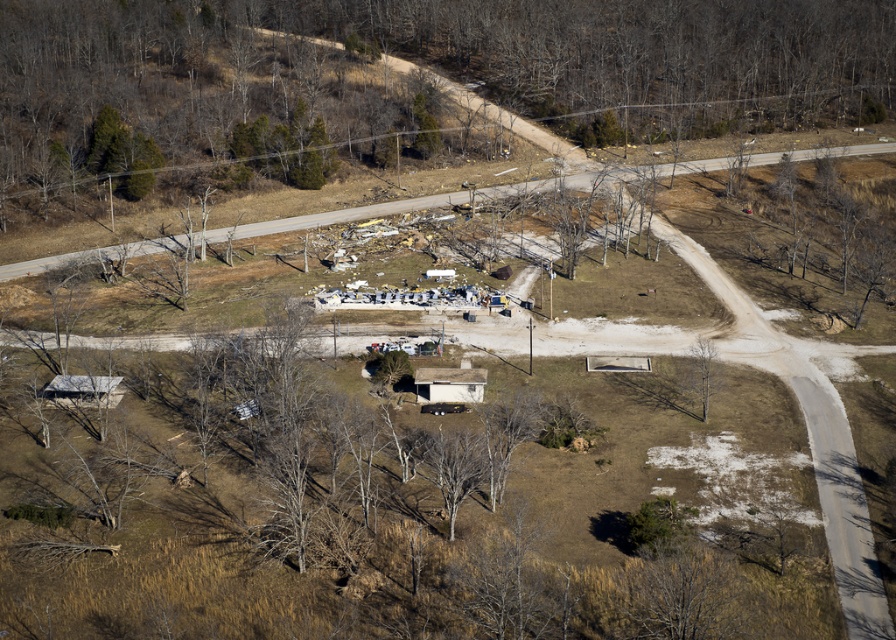
Question: Can you confirm if bare wood tree at center is positioned below green leafy tree at center?

Choices:
 (A) yes
 (B) no

Answer: (A)

Question: In this image, where is bare wood tree at lower right located relative to green leafy tree at center?

Choices:
 (A) below
 (B) above

Answer: (A)

Question: Observing the image, what is the correct spatial positioning of bare wood tree at lower right in reference to green leafy tree at center?

Choices:
 (A) left
 (B) right

Answer: (B)

Question: Among these objects, which one is nearest to the camera?

Choices:
 (A) bare wood tree at lower right
 (B) bare wood tree at center
 (C) green leafy tree at center

Answer: (B)

Question: Which object is farther from the camera taking this photo?

Choices:
 (A) bare wood tree at center
 (B) bare wood tree at lower right

Answer: (B)

Question: Which of the following is the closest to the observer?

Choices:
 (A) bare wood tree at center
 (B) green leafy tree at center

Answer: (A)